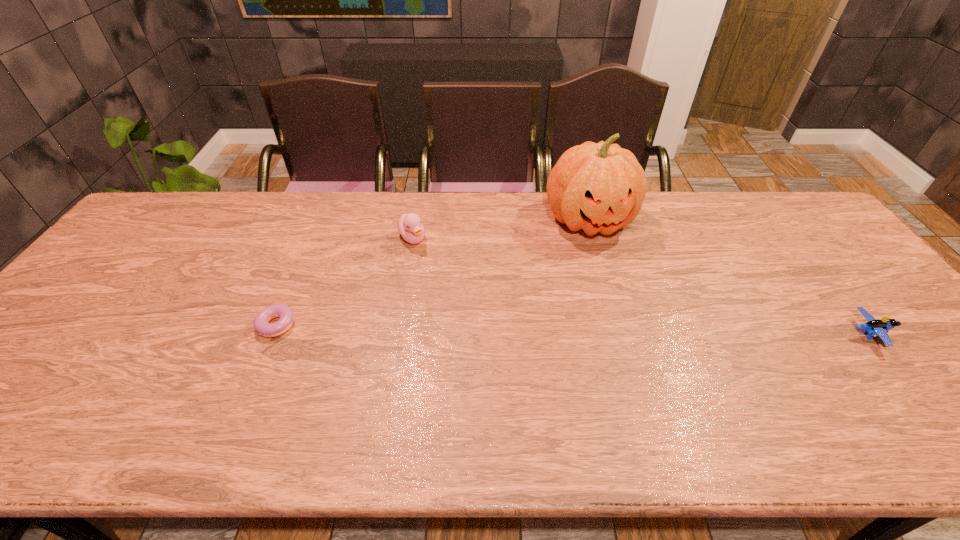
Identify the location of blank area located on the carved face of the pumpkin. The height and width of the screenshot is (540, 960). (622, 300).

This screenshot has height=540, width=960. I want to click on vacant area situated on the carved face of the pumpkin, so click(642, 349).

Where is `vacant region located on the carved face of the pumpkin`? This screenshot has width=960, height=540. vacant region located on the carved face of the pumpkin is located at coordinates (630, 320).

Identify the location of free region located on the front-facing side of the duckling. click(458, 293).

Locate an element on the screen. vacant area located on the front-facing side of the duckling is located at coordinates (466, 302).

Find the location of `vacant region located 0.210m on the front-facing side of the duckling`. vacant region located 0.210m on the front-facing side of the duckling is located at coordinates (456, 291).

This screenshot has height=540, width=960. In order to click on pumpkin present at the far edge in this screenshot , I will do `click(600, 187)`.

Find the location of a particular element. The width and height of the screenshot is (960, 540). duckling that is at the far edge is located at coordinates (410, 226).

Where is `object positioned at the right edge`? Image resolution: width=960 pixels, height=540 pixels. object positioned at the right edge is located at coordinates (874, 327).

This screenshot has width=960, height=540. I want to click on free region at the far edge, so click(697, 195).